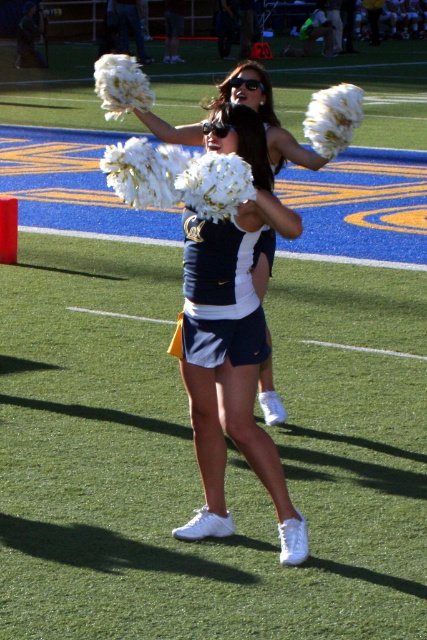
Who is positioned more to the right, navy blue fabric cheerleading uniform at center or white fluffy pom-poms at center?

Positioned to the right is white fluffy pom-poms at center.

Which is above, navy blue fabric cheerleading uniform at center or white fluffy pom-poms at center?

white fluffy pom-poms at center is higher up.

Which is in front, point (216, 244) or point (268, 150)?

Point (216, 244) is more forward.

In order to click on navy blue fabric cheerleading uniform at center in this screenshot , I will do `click(219, 294)`.